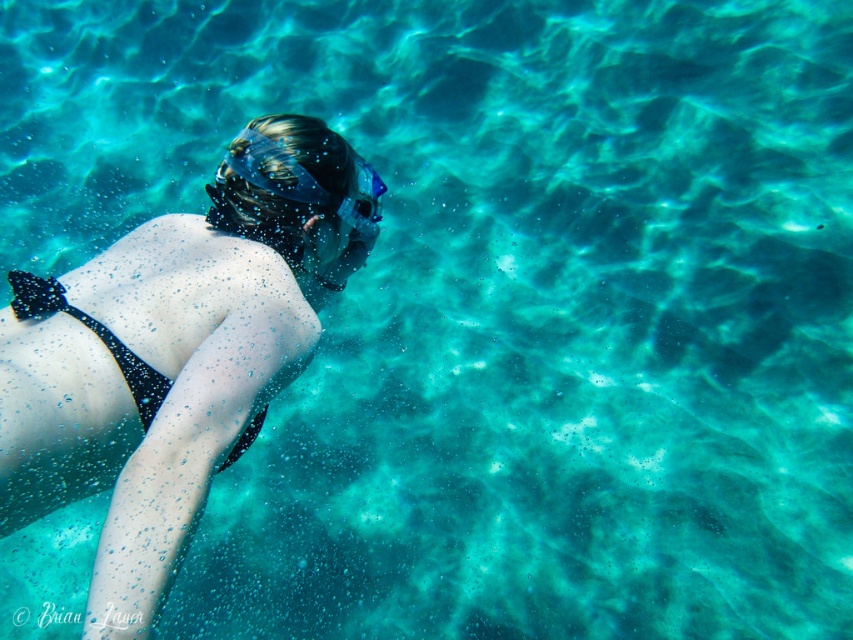
You are a snorkeler preparing to dive underwater. You see the transparent blue goggles at upper center floating in front of you. Can you reach them without moving your body? Your arm length is 0.7 meters.

The transparent blue goggles at upper center are 1.53 meters away from you. Since your arm length is only 0.7 meters, you cannot reach them without moving your body.

You are a marine biologist observing the underwater scene. You notice the matte black bikini at center and the transparent blue goggles at upper center. Which object is positioned higher in the water?

The transparent blue goggles at upper center are positioned higher in the water than the matte black bikini at center.

You are a marine biologist analyzing an underwater image. You need to determine the position of the transparent blue goggles at upper center relative to the snorkeler. Based on the coordinates provided, can you confirm if the goggles are positioned above or below the snorkeler?

The transparent blue goggles at upper center is located at point (310, 180), which means it is positioned above the snorkeler since it is at the upper center of the image.